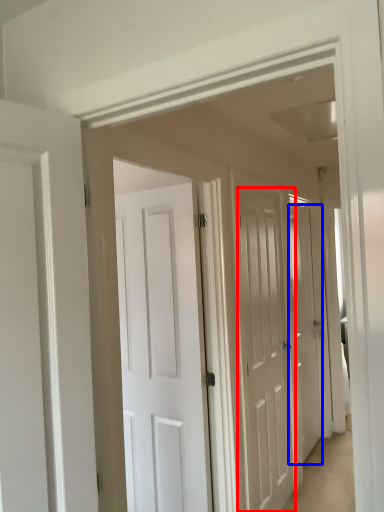
Question: Which of the following is the farthest to the observer, door (highlighted by a red box) or door (highlighted by a blue box)?

Choices:
 (A) door
 (B) door

Answer: (B)